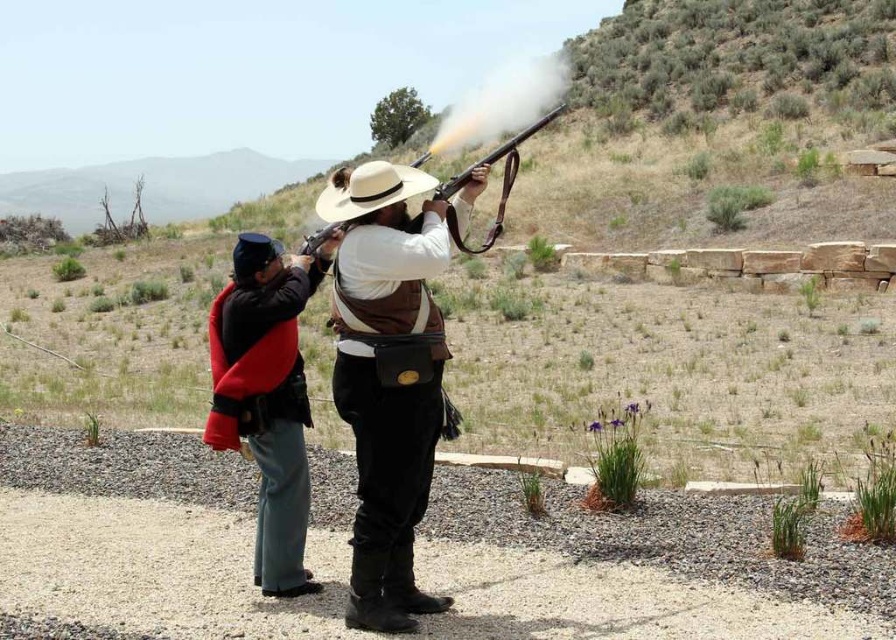
You are a photographer positioned behind the two historical reenactors. You want to capture a clear photo of the matte brown shotgun at center without the red wool coat at center blocking it. What adjustment should you make to your position?

The red wool coat at center is in front of the matte brown shotgun at center. To avoid blocking the shotgun, move to the side so that the coat and shotgun are no longer aligned in the same line of sight.

You are a photographer at the historical reenactment. You need to place a small flag exactly at the point marked by the coordinates point (x=386, y=378). Which object will the flag be placed near?

The flag will be placed near the brown leather vest at center, as the coordinates point (x=386, y=378) marks that object.

You are a photographer taking a picture of the two points in the image. Which point, point (399, 413) or point (279, 538), will appear larger in your photo?

Point (399, 413) is closer to the camera than point (279, 538), so it will appear larger in the photo.